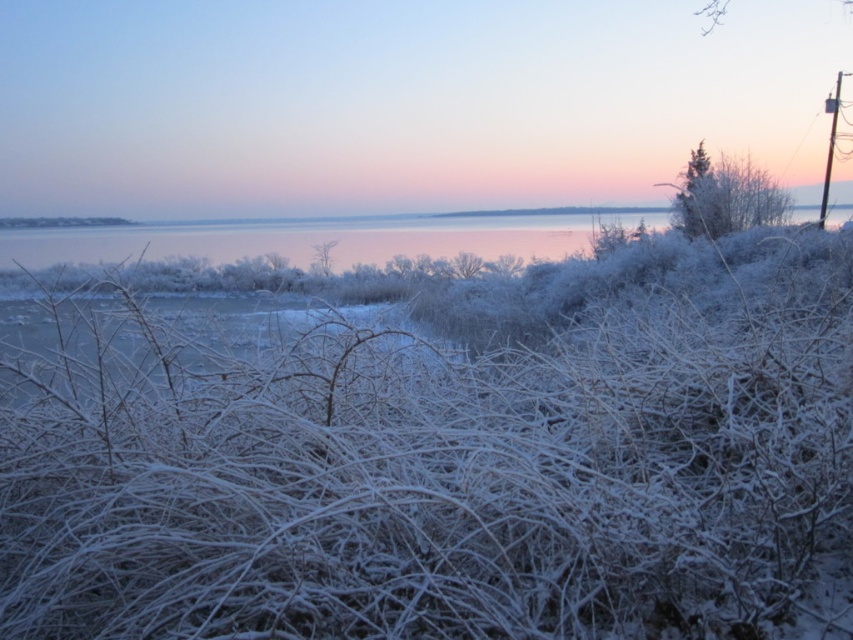
Can you confirm if frosted white grass at center is bigger than silvery reflective water at center?

No.

You are a GUI agent. You are given a task and a screenshot of the screen. Output one action in this format:
    pyautogui.click(x=<x>, y=<y>)
    Task: Click on the frosted white grass at center
    
    Given the screenshot: What is the action you would take?
    pyautogui.click(x=462, y=468)